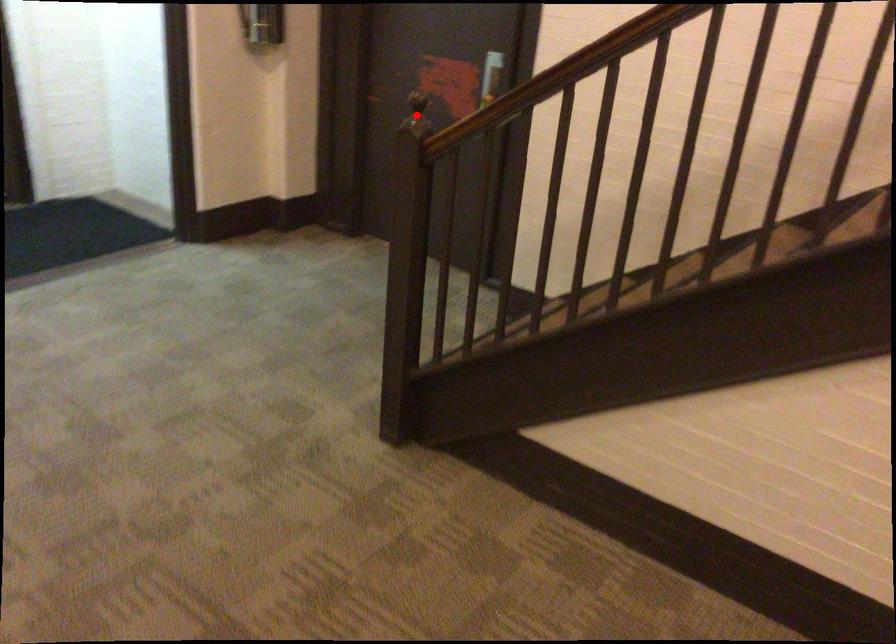
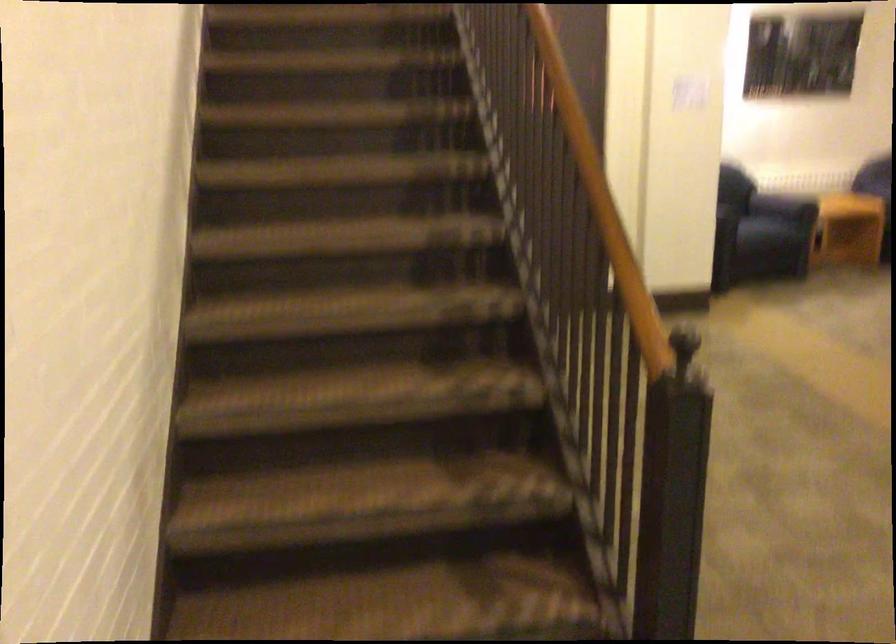
Question: I am providing you with two images of the same scene from different viewpoints. A red point is marked on the first image. Is the red point's position out of view in image 2?

Choices:
 (A) Yes
 (B) No

Answer: (A)